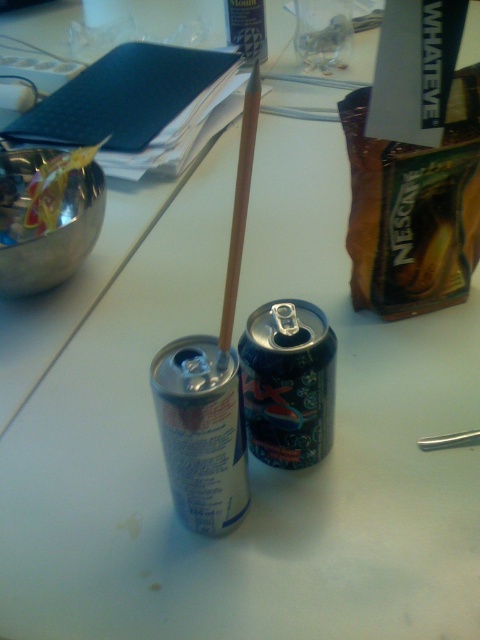
You are organizing items on a desk and notice the shiny metallic can at center and the wooden straw at center. Which item is wider?

The shiny metallic can at center is wider than the wooden straw at center because its width surpasses the wooden straw at center.